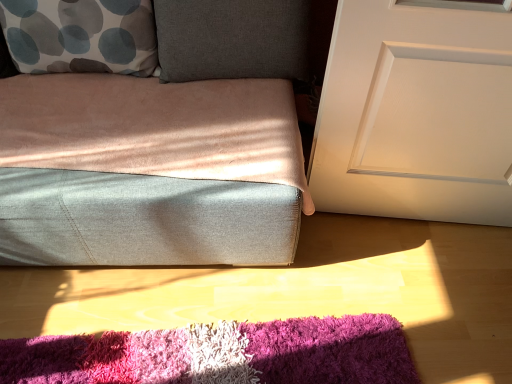
Question: Can you confirm if shaggy multicolor rug at lower center is positioned to the right of white with gray and blue circles pillow at upper left?

Choices:
 (A) no
 (B) yes

Answer: (B)

Question: Does shaggy multicolor rug at lower center turn towards white with gray and blue circles pillow at upper left?

Choices:
 (A) yes
 (B) no

Answer: (B)

Question: Can you confirm if shaggy multicolor rug at lower center is smaller than white with gray and blue circles pillow at upper left?

Choices:
 (A) no
 (B) yes

Answer: (B)

Question: Does shaggy multicolor rug at lower center come behind white with gray and blue circles pillow at upper left?

Choices:
 (A) yes
 (B) no

Answer: (B)

Question: Is shaggy multicolor rug at lower center positioned far away from white with gray and blue circles pillow at upper left?

Choices:
 (A) yes
 (B) no

Answer: (B)

Question: Is shaggy multicolor rug at lower center shorter than white with gray and blue circles pillow at upper left?

Choices:
 (A) no
 (B) yes

Answer: (B)

Question: From the image's perspective, is white with gray and blue circles pillow at upper left on top of shaggy multicolor rug at lower center?

Choices:
 (A) no
 (B) yes

Answer: (B)

Question: From the image's perspective, would you say white with gray and blue circles pillow at upper left is shown under shaggy multicolor rug at lower center?

Choices:
 (A) yes
 (B) no

Answer: (B)

Question: Considering the relative sizes of white with gray and blue circles pillow at upper left and shaggy multicolor rug at lower center in the image provided, is white with gray and blue circles pillow at upper left wider than shaggy multicolor rug at lower center?

Choices:
 (A) no
 (B) yes

Answer: (A)

Question: Is white with gray and blue circles pillow at upper left thinner than shaggy multicolor rug at lower center?

Choices:
 (A) yes
 (B) no

Answer: (A)

Question: Is white with gray and blue circles pillow at upper left in contact with shaggy multicolor rug at lower center?

Choices:
 (A) yes
 (B) no

Answer: (B)

Question: Considering the relative sizes of white with gray and blue circles pillow at upper left and shaggy multicolor rug at lower center in the image provided, is white with gray and blue circles pillow at upper left shorter than shaggy multicolor rug at lower center?

Choices:
 (A) yes
 (B) no

Answer: (B)

Question: From the image's perspective, would you say white matte door at right is positioned over dark gray fabric pillow at upper center?

Choices:
 (A) no
 (B) yes

Answer: (A)